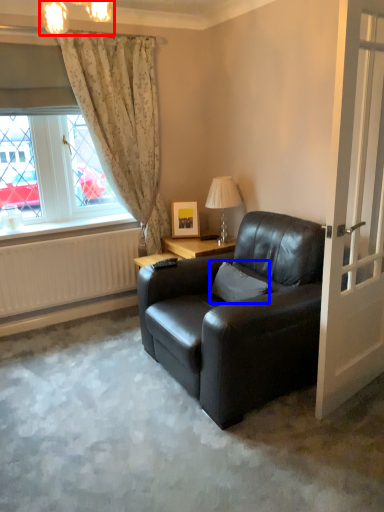
Question: Which object appears farthest to the camera in this image, lamp (highlighted by a red box) or pillow (highlighted by a blue box)?

Choices:
 (A) lamp
 (B) pillow

Answer: (B)